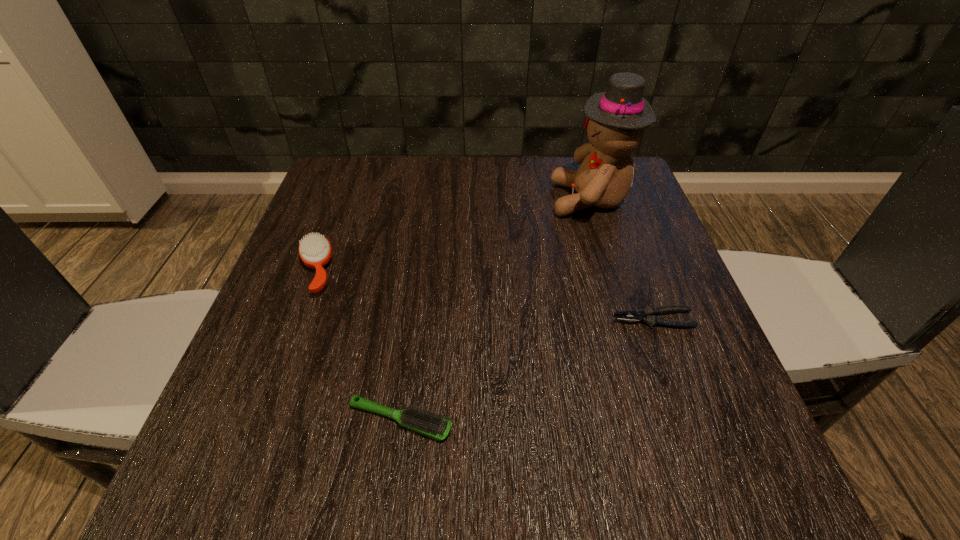
Locate an element on the screen. free space between the taller hairbrush and the farthest object is located at coordinates (453, 235).

You are a GUI agent. You are given a task and a screenshot of the screen. Output one action in this format:
    pyautogui.click(x=<x>, y=<y>)
    Task: Click on the free space between the farthest object and the farther hairbrush
    
    Given the screenshot: What is the action you would take?
    [453, 235]

In order to click on vacant region between the shortest object and the second object from left to right in this screenshot , I will do `click(527, 370)`.

Where is `vacant space that's between the third farthest object and the third nearest object`? The width and height of the screenshot is (960, 540). vacant space that's between the third farthest object and the third nearest object is located at coordinates (485, 295).

You are a GUI agent. You are given a task and a screenshot of the screen. Output one action in this format:
    pyautogui.click(x=<x>, y=<y>)
    Task: Click on the free spot between the third tallest object and the farthest object
    
    Given the screenshot: What is the action you would take?
    pyautogui.click(x=495, y=310)

Locate an element on the screen. free spot between the farthest object and the farther hairbrush is located at coordinates 453,235.

You are a GUI agent. You are given a task and a screenshot of the screen. Output one action in this format:
    pyautogui.click(x=<x>, y=<y>)
    Task: Click on the free space that is in between the second shortest object and the left hairbrush
    This screenshot has height=540, width=960.
    Given the screenshot: What is the action you would take?
    pyautogui.click(x=358, y=346)

This screenshot has width=960, height=540. I want to click on free space between the tallest object and the leftmost object, so click(453, 235).

Where is `unoccupied area between the tallest object and the taller hairbrush`? The width and height of the screenshot is (960, 540). unoccupied area between the tallest object and the taller hairbrush is located at coordinates (453, 235).

I want to click on the second closest object relative to the pliers, so click(x=433, y=425).